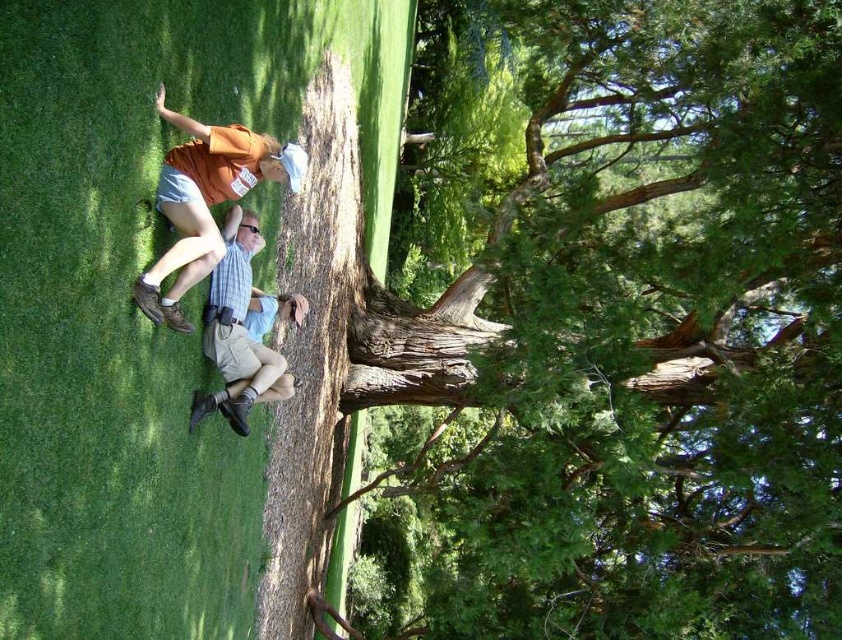
Question: Does green textured tree at center have a greater width compared to light blue denim shorts at center?

Choices:
 (A) no
 (B) yes

Answer: (B)

Question: Can you confirm if orange cotton shirt at upper left is positioned to the right of light blue denim shorts at center?

Choices:
 (A) no
 (B) yes

Answer: (B)

Question: From the image, what is the correct spatial relationship of orange cotton shirt at upper left in relation to light blue denim shorts at center?

Choices:
 (A) below
 (B) above

Answer: (B)

Question: Which point is closer to the camera?

Choices:
 (A) (254, 394)
 (B) (248, 170)
 (C) (536, 477)

Answer: (B)

Question: Based on their relative distances, which object is nearer to the green textured tree at center?

Choices:
 (A) light blue denim shorts at center
 (B) orange cotton shirt at upper left

Answer: (A)

Question: Which point appears farthest from the camera in this image?

Choices:
 (A) (177, 220)
 (B) (249, 300)

Answer: (B)